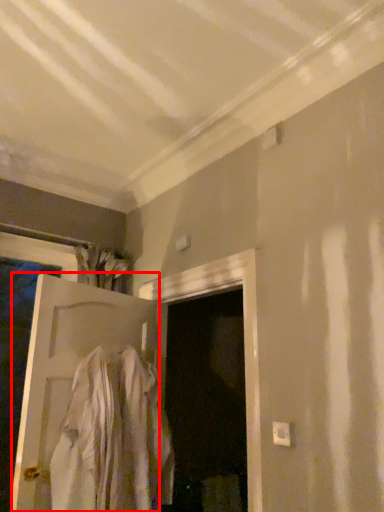
Question: Where is door (annotated by the red box) located in relation to clothing in the image?

Choices:
 (A) left
 (B) right

Answer: (A)